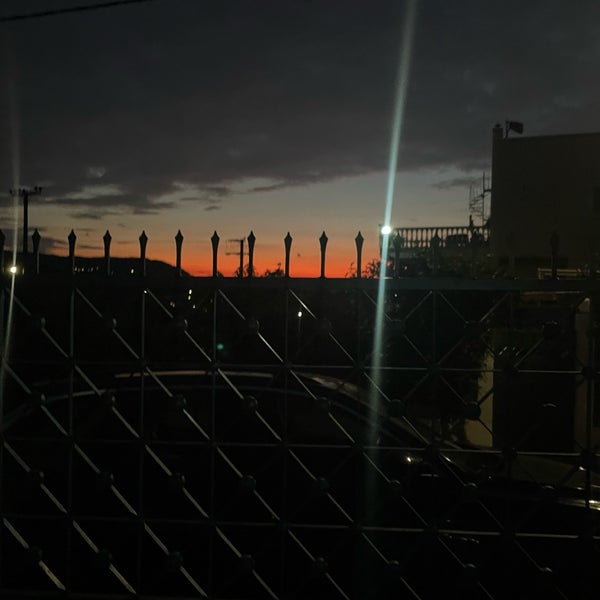
Locate an element on the screen. This screenshot has width=600, height=600. spiral stair is located at coordinates (476, 198).